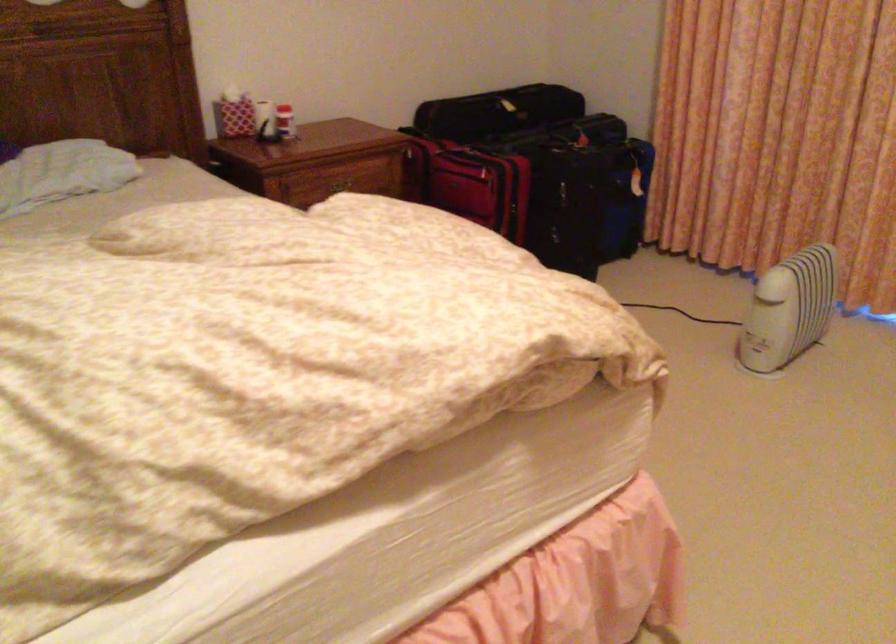
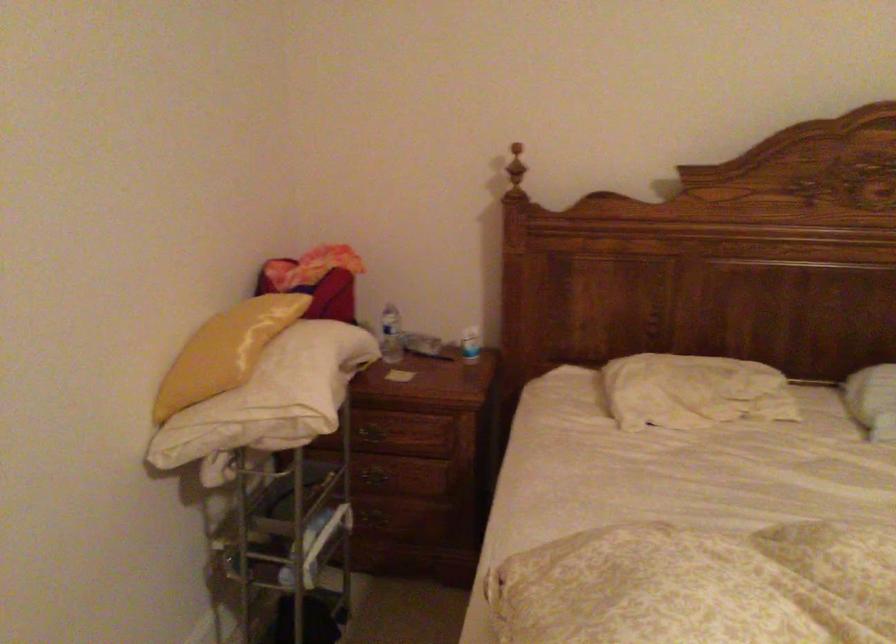
Question: Based on the continuous images, in which direction is the camera rotating? Reply with the corresponding letter.

Choices:
 (A) Left
 (B) Right
 (C) Up
 (D) Down

Answer: (A)